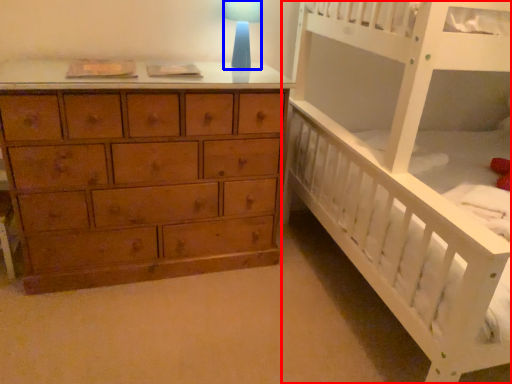
Question: Which object appears closest to the camera in this image, infant bed (highlighted by a red box) or table lamp (highlighted by a blue box)?

Choices:
 (A) infant bed
 (B) table lamp

Answer: (A)